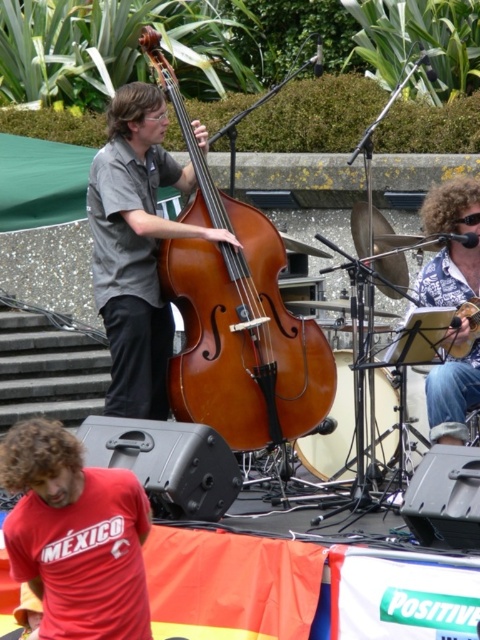
Question: Which object appears farthest from the camera in this image?

Choices:
 (A) shiny brown cello at center
 (B) red cotton t-shirt at lower left
 (C) matte brown double bass at center

Answer: (C)

Question: Estimate the real-world distances between objects in this image. Which object is closer to the shiny brown cello at center?

Choices:
 (A) matte brown double bass at center
 (B) red cotton t-shirt at lower left

Answer: (A)

Question: In this image, where is shiny brown cello at center located relative to red cotton t-shirt at lower left?

Choices:
 (A) below
 (B) above

Answer: (B)

Question: Observing the image, what is the correct spatial positioning of shiny brown cello at center in reference to matte brown double bass at center?

Choices:
 (A) right
 (B) left

Answer: (A)

Question: Which of the following is the closest to the observer?

Choices:
 (A) (36, 532)
 (B) (132, 317)

Answer: (A)

Question: Is red cotton t-shirt at lower left to the right of matte brown double bass at center from the viewer's perspective?

Choices:
 (A) yes
 (B) no

Answer: (B)